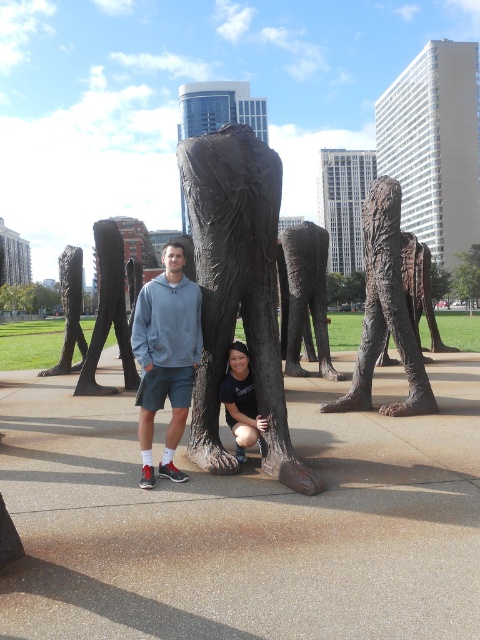
You are taking a photo of the public art installation. You want to ensure the bronze textured sculpture at center and the bronze statue leg at center are both clearly visible. Based on their positions, which one is closer to the camera?

The bronze textured sculpture at center is closer to the camera since it is in front of the bronze statue leg at center.

You are a photographer trying to capture both the matte gray hoodie at center and the matte black shirt at center in the same frame. Since you want to ensure both are visible, which one should you focus on first to maintain depth of field?

The matte gray hoodie at center is taller than the matte black shirt at center. To maintain depth of field, focus on the matte gray hoodie at center first as it is taller and likely further away, ensuring both subjects remain sharp.